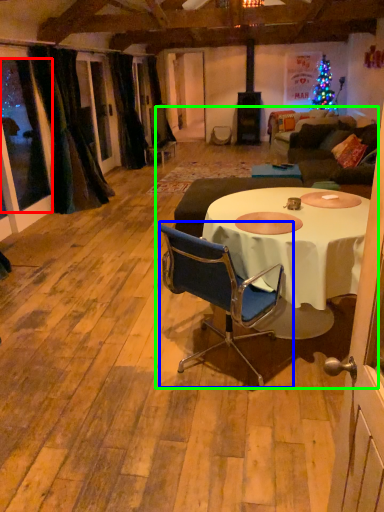
Question: Which object is positioned farthest from window screen (highlighted by a red box)? Select from chair (highlighted by a blue box) and dinner party (highlighted by a green box).

Choices:
 (A) chair
 (B) dinner party

Answer: (A)